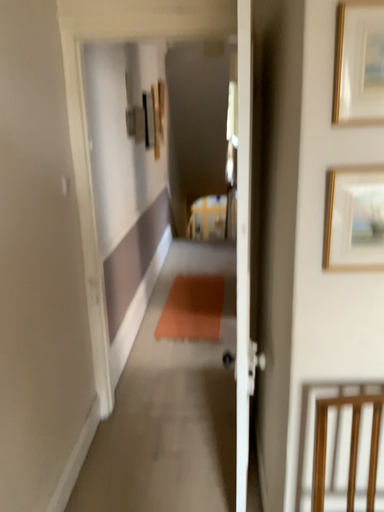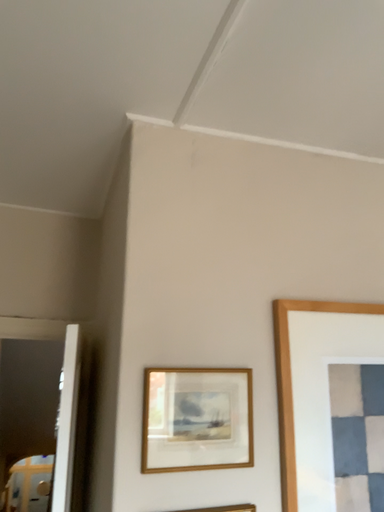
Question: Which way did the camera rotate in the video?

Choices:
 (A) rotated left
 (B) rotated right

Answer: (B)